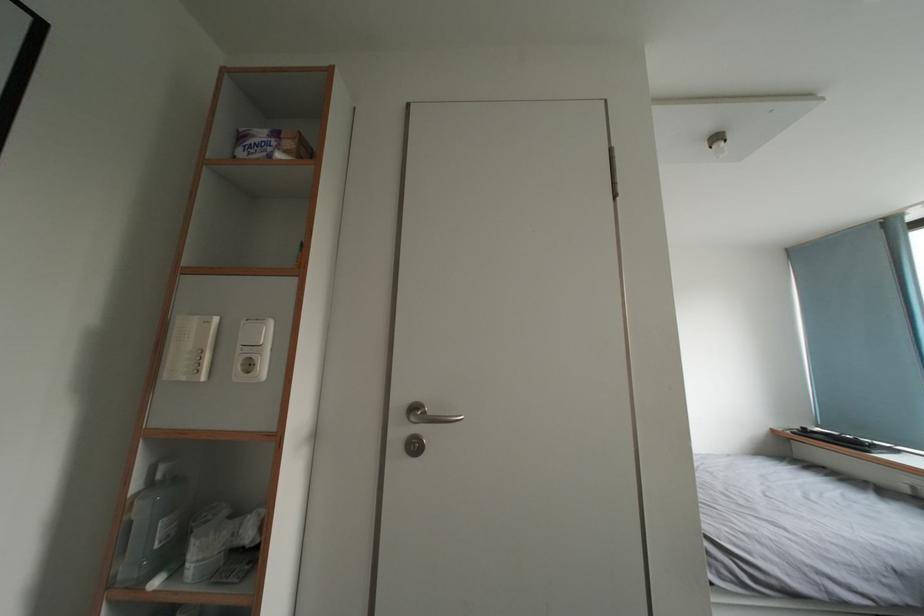
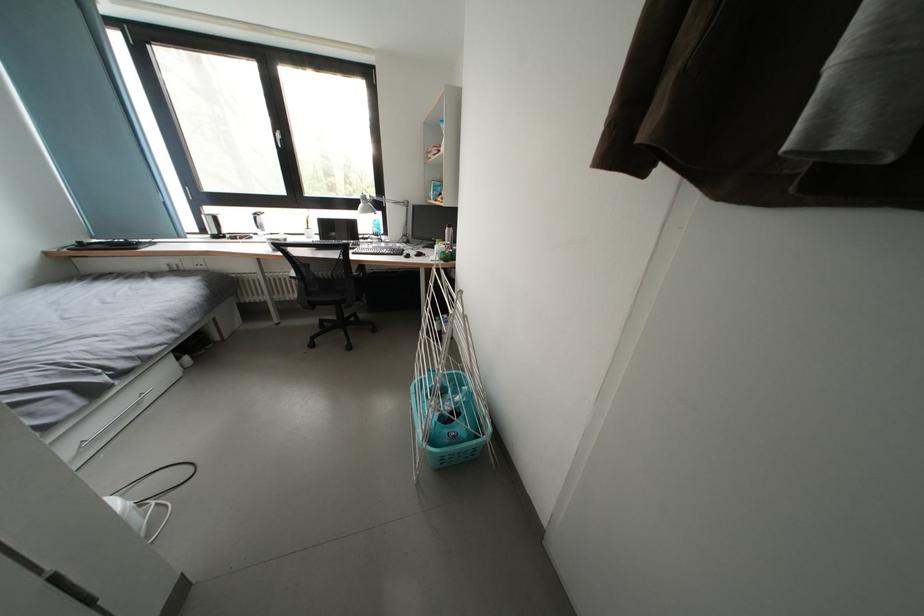
Based on the continuous images, in which direction is the camera rotating?

The camera rotated toward right-down.